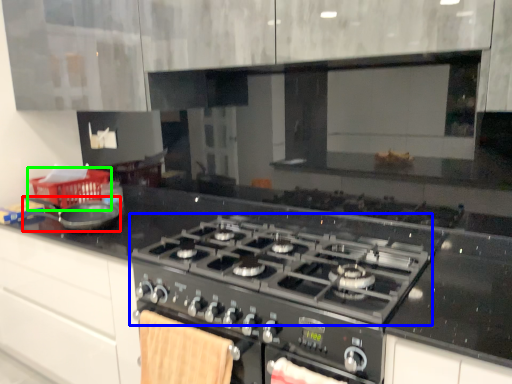
Question: Considering the real-world distances, which object is closest to kitchen appliance (highlighted by a red box)? gas stove (highlighted by a blue box) or basket (highlighted by a green box).

Choices:
 (A) gas stove
 (B) basket

Answer: (B)